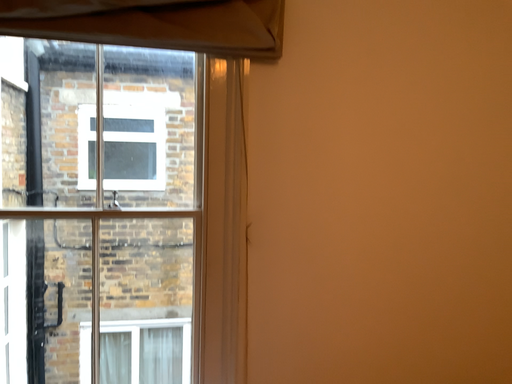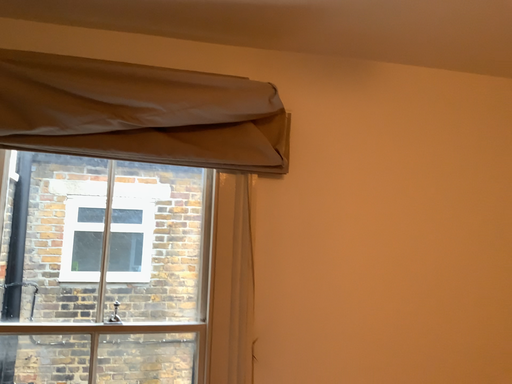
Question: How did the camera likely rotate when shooting the video?

Choices:
 (A) rotated upward
 (B) rotated downward

Answer: (A)